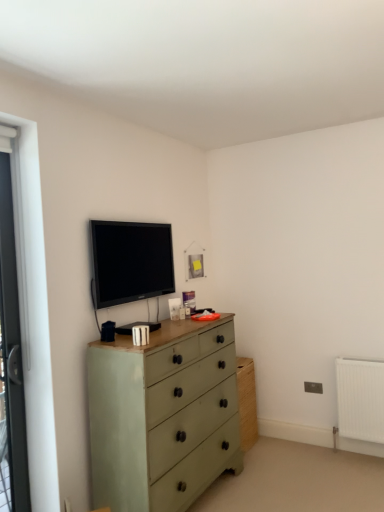
Question: Considering the relative sizes of matte green chest of drawers at center and matte black tv at upper center in the image provided, is matte green chest of drawers at center smaller than matte black tv at upper center?

Choices:
 (A) yes
 (B) no

Answer: (B)

Question: Does matte green chest of drawers at center have a greater height compared to matte black tv at upper center?

Choices:
 (A) no
 (B) yes

Answer: (B)

Question: Can you confirm if matte green chest of drawers at center is bigger than matte black tv at upper center?

Choices:
 (A) no
 (B) yes

Answer: (B)

Question: Is matte green chest of drawers at center in contact with matte black tv at upper center?

Choices:
 (A) no
 (B) yes

Answer: (A)

Question: From a real-world perspective, is matte green chest of drawers at center on top of matte black tv at upper center?

Choices:
 (A) no
 (B) yes

Answer: (A)

Question: Considering the relative sizes of matte green chest of drawers at center and matte black tv at upper center in the image provided, is matte green chest of drawers at center wider than matte black tv at upper center?

Choices:
 (A) no
 (B) yes

Answer: (B)

Question: Can you confirm if white plastic screen door at left is positioned to the left of matte black tv at upper center?

Choices:
 (A) no
 (B) yes

Answer: (B)

Question: From the image's perspective, is white plastic screen door at left above matte black tv at upper center?

Choices:
 (A) no
 (B) yes

Answer: (A)

Question: Considering the relative sizes of white plastic screen door at left and matte black tv at upper center in the image provided, is white plastic screen door at left taller than matte black tv at upper center?

Choices:
 (A) yes
 (B) no

Answer: (A)

Question: Can you confirm if white plastic screen door at left is bigger than matte black tv at upper center?

Choices:
 (A) no
 (B) yes

Answer: (A)

Question: Can you confirm if white plastic screen door at left is positioned to the right of matte black tv at upper center?

Choices:
 (A) no
 (B) yes

Answer: (A)

Question: Is white plastic screen door at left in front of matte black tv at upper center?

Choices:
 (A) no
 (B) yes

Answer: (B)

Question: From a real-world perspective, is matte green chest of drawers at center physically below white plastic screen door at left?

Choices:
 (A) no
 (B) yes

Answer: (B)